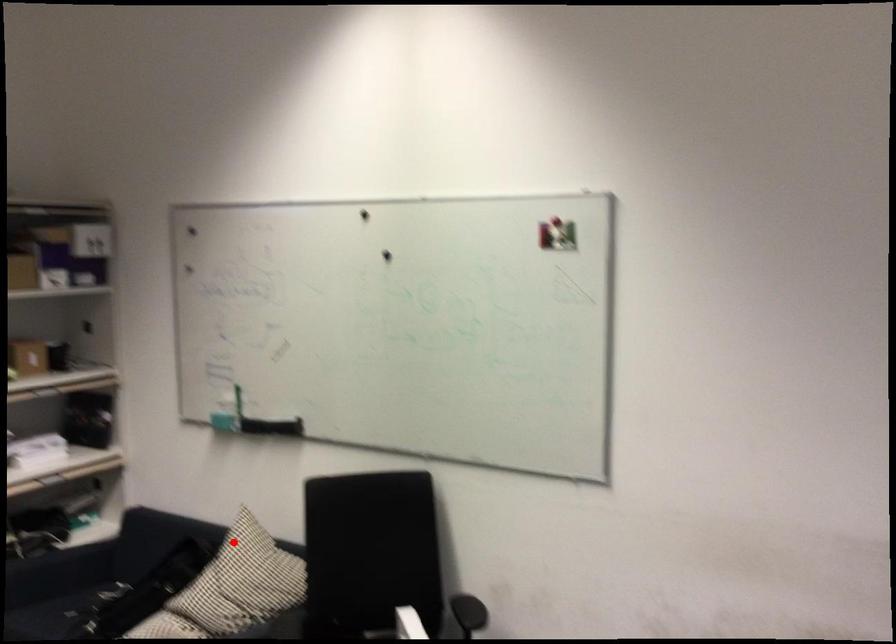
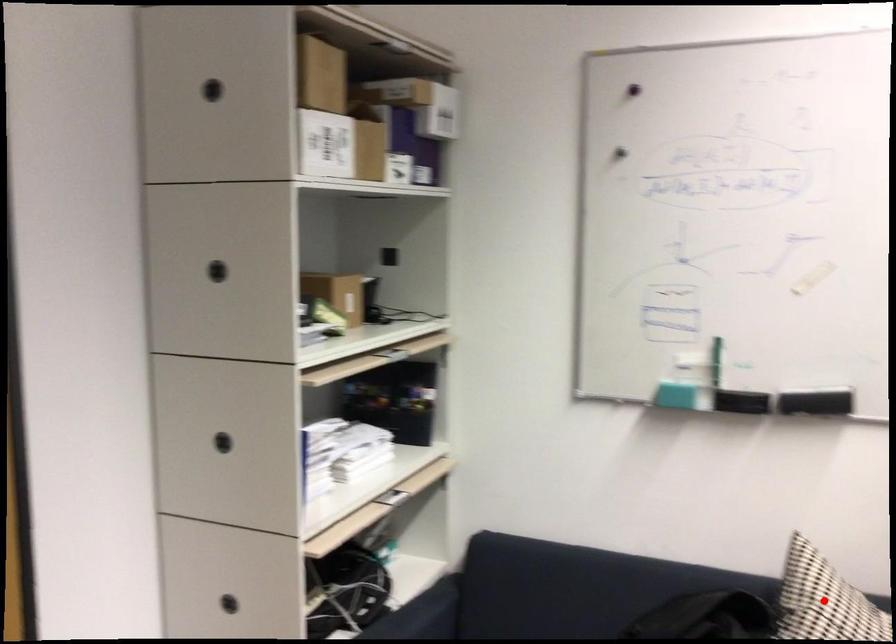
I am providing you with two images of the same scene from different viewpoints. A red point is marked on the first image and another point is marked on the second image. Are the points marked in image1 and image2 representing the same 3D position?

Yes